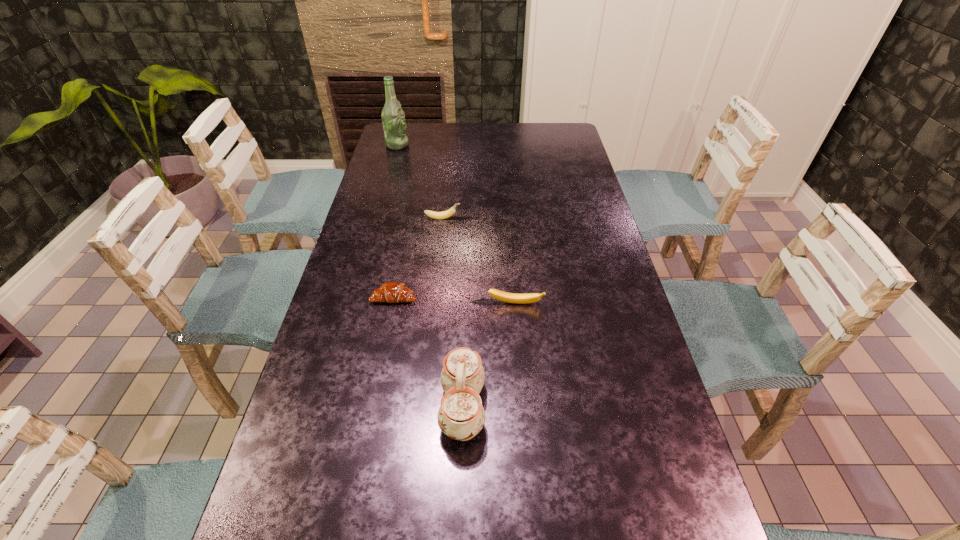
This screenshot has height=540, width=960. I want to click on beer bottle, so click(393, 117).

Where is `the farthest object`? This screenshot has height=540, width=960. the farthest object is located at coordinates (393, 117).

Locate an element on the screen. The height and width of the screenshot is (540, 960). the nearest object is located at coordinates (461, 416).

Locate an element on the screen. the second tallest object is located at coordinates (461, 416).

This screenshot has width=960, height=540. In order to click on the farther banana in this screenshot , I will do `click(445, 214)`.

Identify the location of the second farthest object. This screenshot has height=540, width=960. (445, 214).

Where is `the nearer banana`? The height and width of the screenshot is (540, 960). the nearer banana is located at coordinates (496, 294).

Find the location of `the right banana`. the right banana is located at coordinates (496, 294).

This screenshot has width=960, height=540. What are the coordinates of `crescent roll` in the screenshot? It's located at (391, 292).

This screenshot has height=540, width=960. Find the location of `vacant space positioned 0.290m on the surface of the tallest object`. vacant space positioned 0.290m on the surface of the tallest object is located at coordinates (477, 145).